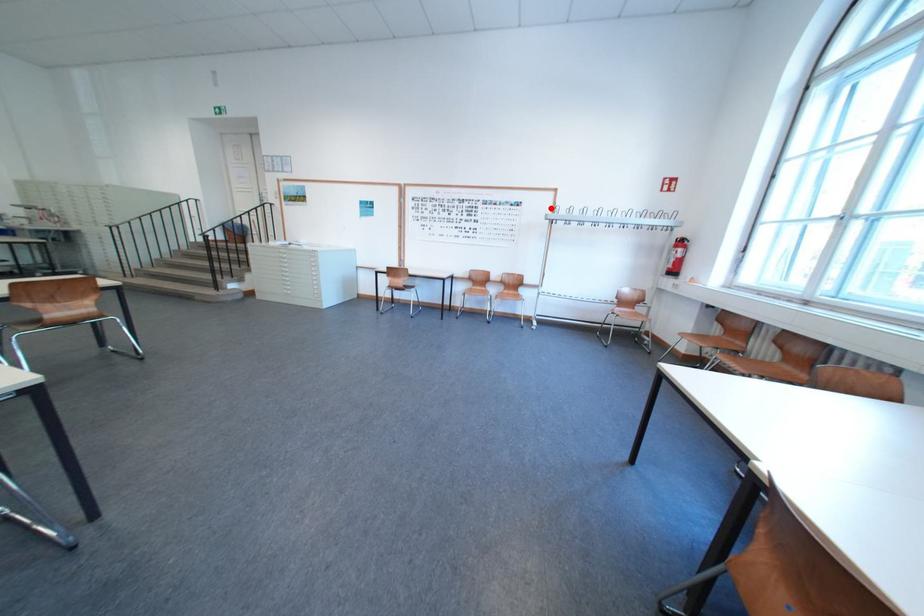
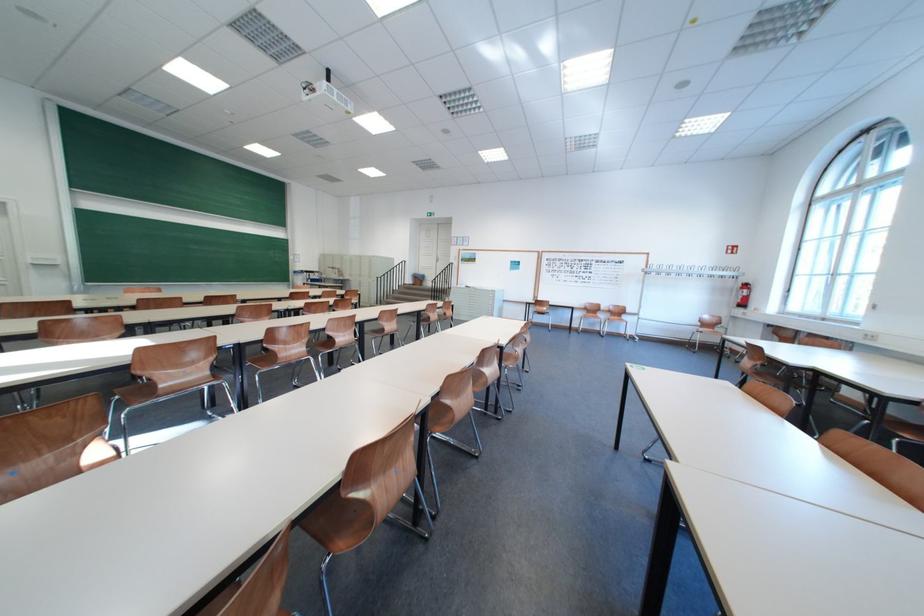
Locate, in the second image, the point that corresponds to the highlighted location in the first image.

(649, 265)